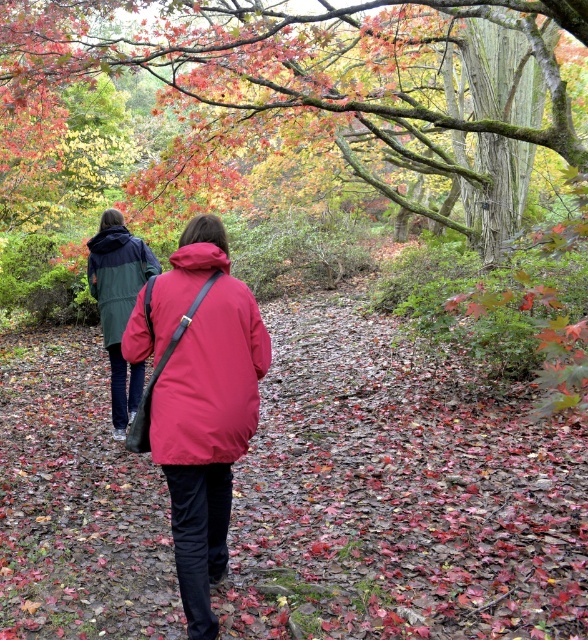
Question: Among these objects, which one is nearest to the camera?

Choices:
 (A) leaves at center
 (B) smooth bark tree at upper center
 (C) matte red jacket at center
 (D) green matte jacket at left

Answer: (C)

Question: Which is farther from the green matte jacket at left?

Choices:
 (A) leaves at center
 (B) smooth bark tree at upper center
 (C) matte red jacket at center

Answer: (B)

Question: Can you confirm if smooth bark tree at upper center is smaller than green matte jacket at left?

Choices:
 (A) yes
 (B) no

Answer: (B)

Question: Is matte red jacket at center smaller than green matte jacket at left?

Choices:
 (A) no
 (B) yes

Answer: (B)

Question: Among these objects, which one is nearest to the camera?

Choices:
 (A) leaves at center
 (B) green matte jacket at left
 (C) smooth bark tree at upper center
 (D) matte red jacket at center

Answer: (D)

Question: Is smooth bark tree at upper center smaller than matte red jacket at center?

Choices:
 (A) no
 (B) yes

Answer: (A)